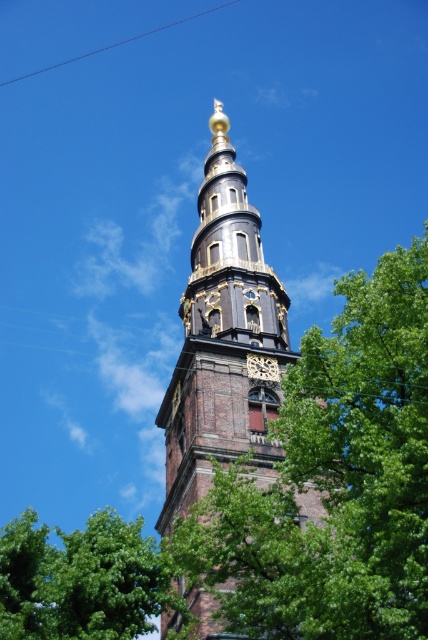
You are standing at the base of the brown brick tower at center and want to place a flagpole at a distance that is exactly 30 meters away from it. Is this possible?

The distance between the brown brick tower at center and the flagpole would need to be exactly 30 meters, but the objects description states they are 35.39 meters apart. Therefore, placing the flagpole at 30 meters away is not possible as it would be shorter than the existing distance.

You are an architect analyzing the church tower. You notice the green leafy tree at lower left and the metallic wire at upper center. Which object is located to the right of the other?

The green leafy tree at lower left is positioned on the right side of metallic wire at upper center.

You are standing in front of the church tower and want to locate the point marked at coordinates point (223, 340). Based on the scene description, where exactly is this point located on the brown brick tower at center?

The point (223, 340) is located on the brown brick tower at center, specifically at its base where the clock face with Roman numerals is situated.